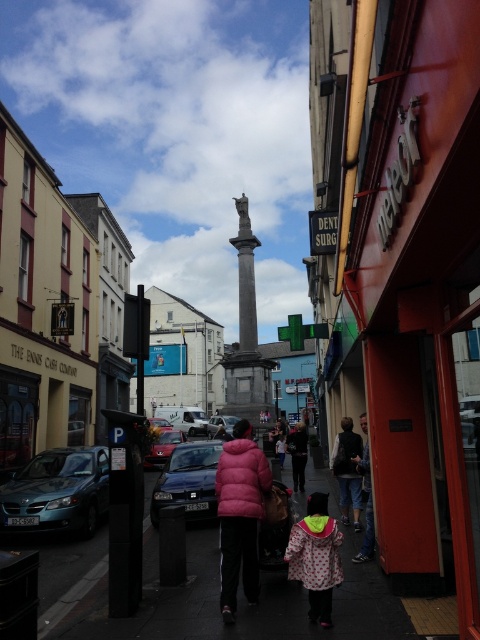
Is smooth asphalt pavement at center closer to camera compared to granite column at center?

Yes, smooth asphalt pavement at center is closer to the viewer.

Can you confirm if smooth asphalt pavement at center is taller than granite column at center?

Incorrect, smooth asphalt pavement at center's height is not larger of granite column at center's.

Between point (315, 483) and point (231, 381), which one is positioned in front?

Point (315, 483)

Identify the location of smooth asphalt pavement at center. The image size is (480, 640). (217, 602).

Does polka dot coat at center have a larger size compared to velvet black jacket at lower right?

No, polka dot coat at center is not bigger than velvet black jacket at lower right.

Does point (290, 560) come in front of point (354, 476)?

Yes, it is in front of point (354, 476).

Where is `polka dot coat at center`? Image resolution: width=480 pixels, height=640 pixels. polka dot coat at center is located at coordinates (315, 557).

Between pink matte jacket at center and matte black car at center, which one is positioned lower?

matte black car at center is lower down.

Which is more to the right, pink matte jacket at center or matte black car at center?

Positioned to the right is pink matte jacket at center.

Is point (240, 445) farther from viewer compared to point (162, 440)?

No, (240, 445) is closer to viewer.

Find the location of a particular element. Image resolution: width=480 pixels, height=640 pixels. pink matte jacket at center is located at coordinates (240, 515).